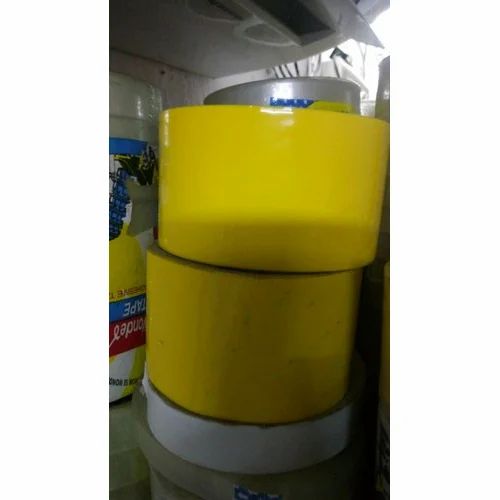
Locate an element on the screen. Image resolution: width=500 pixels, height=500 pixels. slightly curved concrete ceiling is located at coordinates (201, 34).